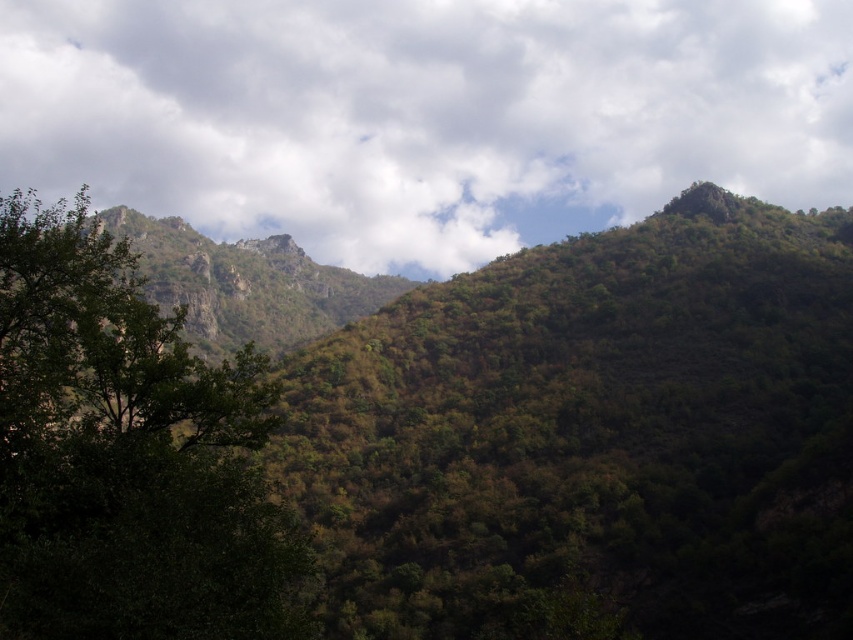
Question: Which of the following is the closest to the observer?

Choices:
 (A) green leafy forest at upper center
 (B) white fluffy cloud at upper center
 (C) green leafy tree at left

Answer: (C)

Question: Does green leafy forest at upper center have a lesser width compared to green leafy tree at left?

Choices:
 (A) no
 (B) yes

Answer: (A)

Question: Does green leafy forest at upper center come behind white fluffy cloud at upper center?

Choices:
 (A) no
 (B) yes

Answer: (A)

Question: Which point is farther to the camera?

Choices:
 (A) green leafy tree at left
 (B) white fluffy cloud at upper center

Answer: (B)

Question: Can you confirm if green leafy forest at upper center is smaller than green leafy tree at left?

Choices:
 (A) yes
 (B) no

Answer: (B)

Question: Among these points, which one is nearest to the camera?

Choices:
 (A) (660, 413)
 (B) (592, 186)
 (C) (209, 365)

Answer: (A)